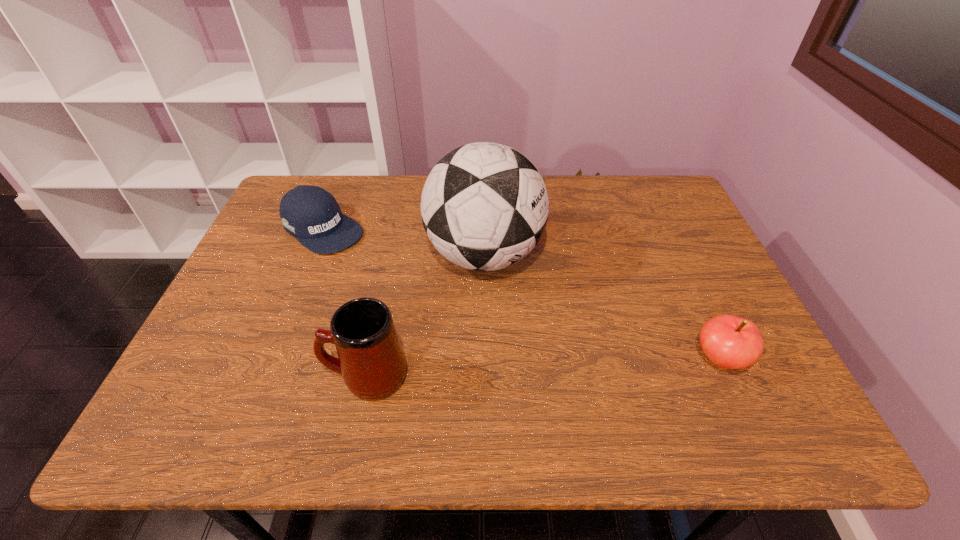
Locate an element on the screen. The image size is (960, 540). free space on the desktop that is between the mug and the rightmost object and is positioned on the surface of the tallest object where the brand logo is visible is located at coordinates (578, 366).

Where is `free space on the desktop that is between the mug and the apple and is positioned on the front-facing side of the baseball cap`? The image size is (960, 540). free space on the desktop that is between the mug and the apple and is positioned on the front-facing side of the baseball cap is located at coordinates (523, 369).